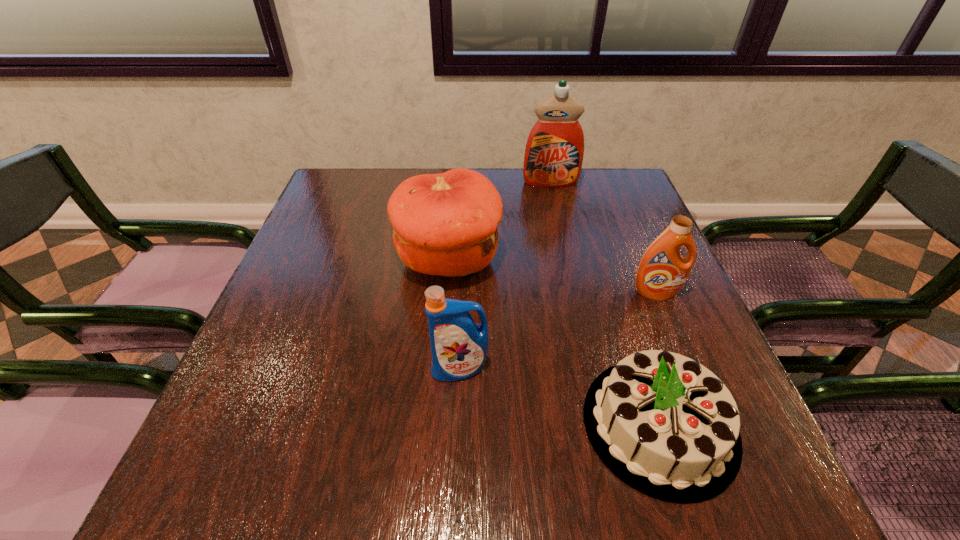
The image size is (960, 540). I want to click on free spot located on the left of the birthday cake, so click(x=496, y=424).

The image size is (960, 540). What are the coordinates of `object that is at the far edge` in the screenshot? It's located at (554, 151).

You are a GUI agent. You are given a task and a screenshot of the screen. Output one action in this format:
    pyautogui.click(x=<x>, y=<y>)
    Task: Click on the object that is at the near edge
    This screenshot has height=540, width=960.
    Given the screenshot: What is the action you would take?
    pyautogui.click(x=668, y=427)

I want to click on birthday cake present at the right edge, so pyautogui.click(x=668, y=427).

I want to click on object present at the far right corner, so click(x=554, y=151).

Where is `object present at the near right corner`? Image resolution: width=960 pixels, height=540 pixels. object present at the near right corner is located at coordinates (668, 427).

Locate an element on the screen. The image size is (960, 540). free region at the left edge of the desktop is located at coordinates (254, 430).

In the image, there is a desktop. Identify the location of free space at the right edge. (637, 352).

Identify the location of free space between the birthday cake and the nearest detergent. (560, 396).

At what (x,y) coordinates should I click in order to perform the action: click on vacant space that is in between the second nearest detergent and the pumpkin. Please return your answer as a coordinate pair (x, y). The height and width of the screenshot is (540, 960). Looking at the image, I should click on (552, 276).